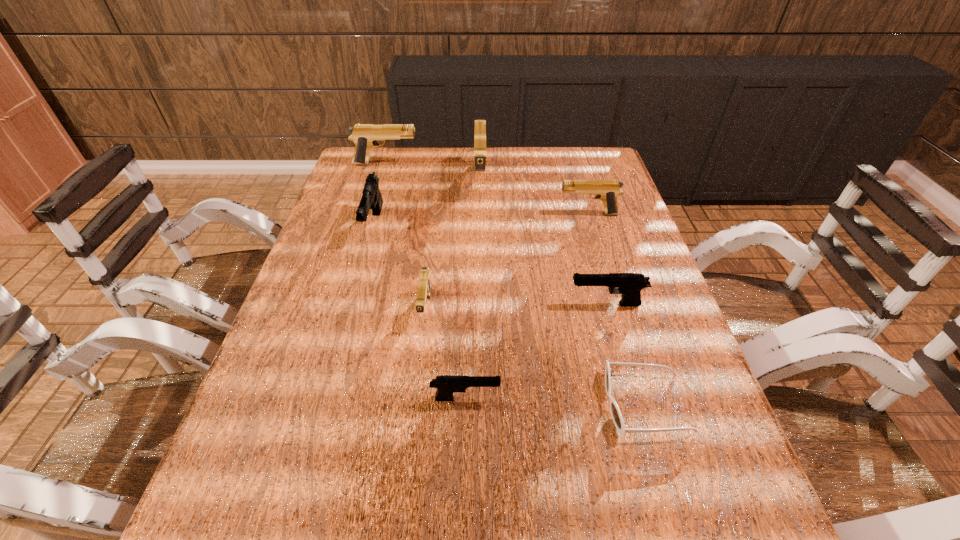
Find the location of a particular element. The width and height of the screenshot is (960, 540). the second closest black pistol to the tallest pistol is located at coordinates (630, 285).

Locate an element on the screen. black pistol that is the closest to the rightmost black pistol is located at coordinates (446, 385).

Where is `vacant space that satisfies the following two spatial constraints: 1. on the front-facing side of the second smallest black pistol; 2. at the barrel of the smallest tan pistol`? The width and height of the screenshot is (960, 540). vacant space that satisfies the following two spatial constraints: 1. on the front-facing side of the second smallest black pistol; 2. at the barrel of the smallest tan pistol is located at coordinates (608, 309).